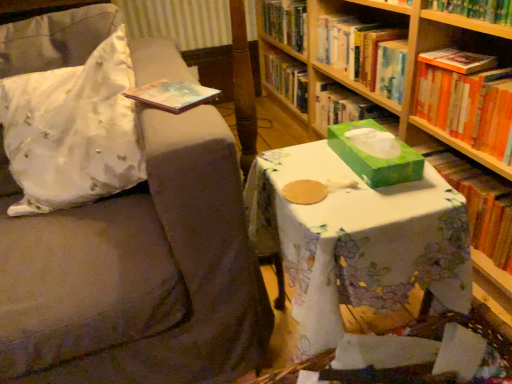
The image size is (512, 384). I want to click on empty space that is ontop of hardcover book at upper right, the 1th book positioned from the top (from a real-world perspective), so point(371,24).